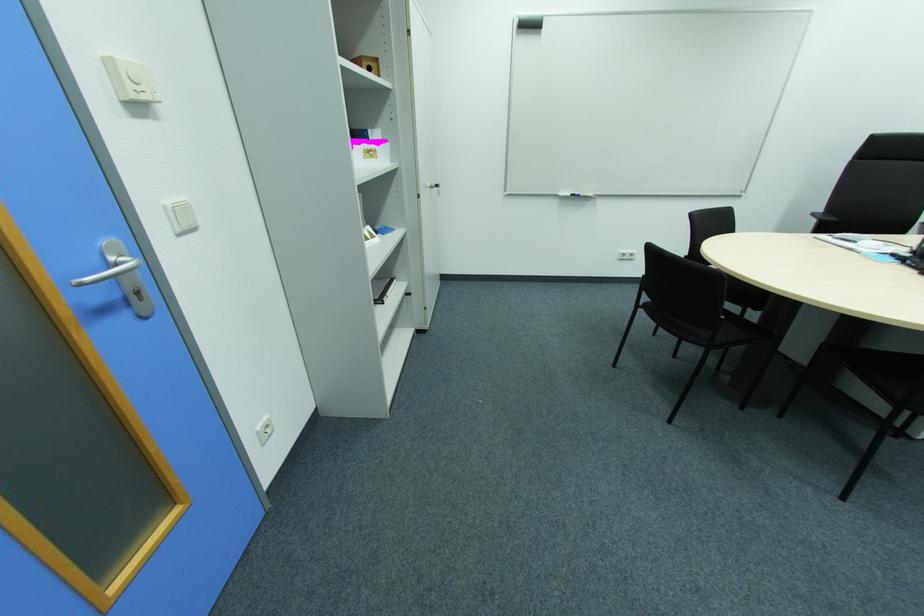
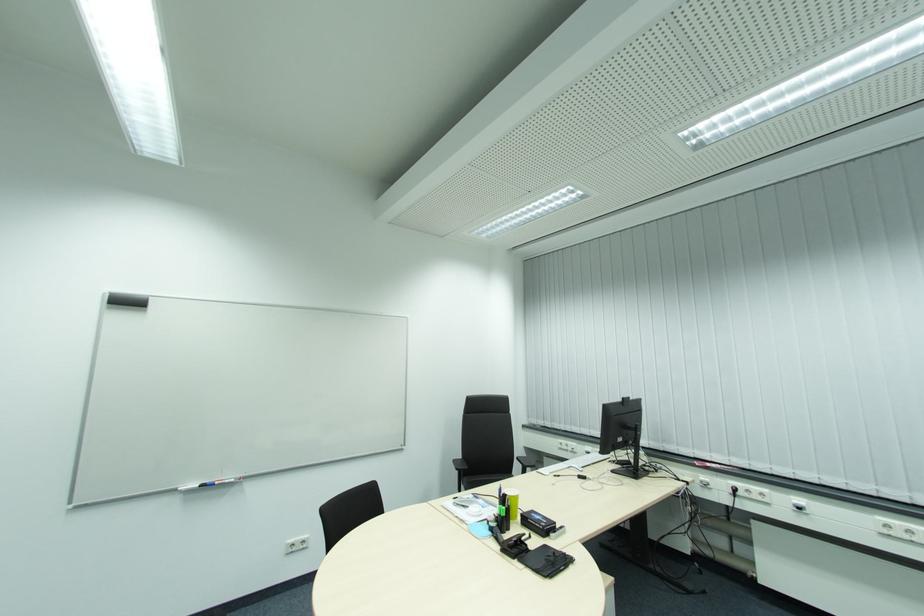
How did the camera likely rotate?

The camera's rotation is toward right-up.